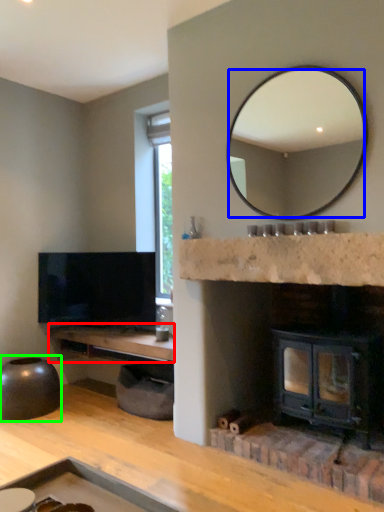
Question: Which object is the closest to the counter top (highlighted by a red box)? Choose among these: mirror (highlighted by a blue box) or round table (highlighted by a green box).

Choices:
 (A) mirror
 (B) round table

Answer: (B)